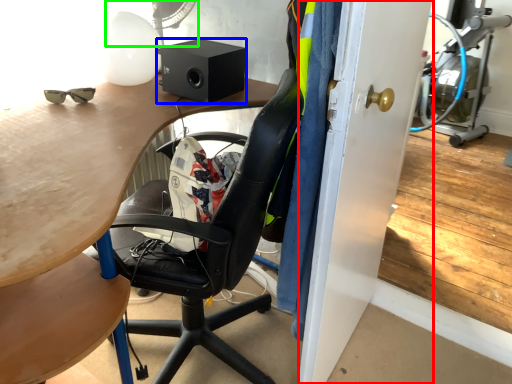
Question: Estimate the real-world distances between objects in this image. Which object is closer to glass door (highlighted by a red box), loudspeaker (highlighted by a blue box) or mechanical fan (highlighted by a green box)?

Choices:
 (A) loudspeaker
 (B) mechanical fan

Answer: (A)